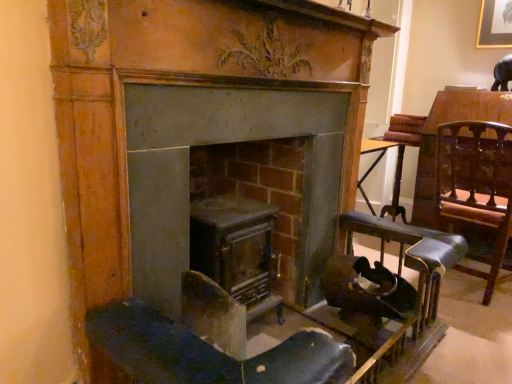
Identify the location of metallic gray stove at center, marked as the 2th fireplace in a right-to-left arrangement. The image size is (512, 384). pos(218,143).

The height and width of the screenshot is (384, 512). In order to click on metallic gray stove at center, marked as the 2th fireplace in a right-to-left arrangement in this screenshot , I will do `click(218, 143)`.

Does matte gray fireplace at center, which is the 2th fireplace in left-to-right order, touch leather seat at right?

matte gray fireplace at center, which is the 2th fireplace in left-to-right order, and leather seat at right are not in contact.

Who is shorter, matte gray fireplace at center, the 1th fireplace when ordered from right to left, or leather seat at right?

leather seat at right is shorter.

Which is farther, (79, 241) or (439, 204)?

The point (439, 204) is farther from the camera.

In terms of width, does matte gray fireplace at center, which is the 2th fireplace in left-to-right order, look wider or thinner when compared to leather seat at right?

matte gray fireplace at center, which is the 2th fireplace in left-to-right order, is thinner than leather seat at right.

Does point (441, 162) appear closer or farther from the camera than point (132, 116)?

Point (441, 162) is positioned farther from the camera compared to point (132, 116).

Considering the sizes of objects leather seat at right and metallic gray stove at center, which ranks as the first fireplace in left-to-right order, in the image provided, who is wider, leather seat at right or metallic gray stove at center, which ranks as the first fireplace in left-to-right order,?

metallic gray stove at center, which ranks as the first fireplace in left-to-right order.

From the image's perspective, which one is positioned higher, leather seat at right or metallic gray stove at center, marked as the 2th fireplace in a right-to-left arrangement?

From the image's view, leather seat at right is above.

Is the position of leather seat at right more distant than that of metallic gray stove at center, which ranks as the first fireplace in left-to-right order?

Yes, leather seat at right is further from the viewer.

In terms of height, does matte gray fireplace at center, the 1th fireplace when ordered from right to left, look taller or shorter compared to metallic gray stove at center, which ranks as the first fireplace in left-to-right order?

matte gray fireplace at center, the 1th fireplace when ordered from right to left, is taller than metallic gray stove at center, which ranks as the first fireplace in left-to-right order.

Considering the positions of objects matte gray fireplace at center, the 1th fireplace when ordered from right to left, and metallic gray stove at center, which ranks as the first fireplace in left-to-right order, in the image provided, who is more to the right, matte gray fireplace at center, the 1th fireplace when ordered from right to left, or metallic gray stove at center, which ranks as the first fireplace in left-to-right order,?

Positioned to the right is matte gray fireplace at center, the 1th fireplace when ordered from right to left.

Is matte gray fireplace at center, the 1th fireplace when ordered from right to left, not close to metallic gray stove at center, marked as the 2th fireplace in a right-to-left arrangement?

No, matte gray fireplace at center, the 1th fireplace when ordered from right to left, is not far away from metallic gray stove at center, marked as the 2th fireplace in a right-to-left arrangement.

Is leather seat at right taller or shorter than matte gray fireplace at center, which is the 2th fireplace in left-to-right order?

leather seat at right is shorter than matte gray fireplace at center, which is the 2th fireplace in left-to-right order.

Between point (477, 137) and point (113, 33), which one is positioned in front?

Positioned in front is point (113, 33).

Identify the location of swivel chair below the matte gray fireplace at center, the 1th fireplace when ordered from right to left (from a real-world perspective). (476, 186).

From the picture: Does leather seat at right touch matte gray fireplace at center, which is the 2th fireplace in left-to-right order?

No, leather seat at right is not in contact with matte gray fireplace at center, which is the 2th fireplace in left-to-right order.

From the image's perspective, is metallic gray stove at center, marked as the 2th fireplace in a right-to-left arrangement, above or below matte gray fireplace at center, the 1th fireplace when ordered from right to left?

Based on their image positions, metallic gray stove at center, marked as the 2th fireplace in a right-to-left arrangement, is located beneath matte gray fireplace at center, the 1th fireplace when ordered from right to left.

How much distance is there between metallic gray stove at center, marked as the 2th fireplace in a right-to-left arrangement, and matte gray fireplace at center, which is the 2th fireplace in left-to-right order?

metallic gray stove at center, marked as the 2th fireplace in a right-to-left arrangement, and matte gray fireplace at center, which is the 2th fireplace in left-to-right order, are 5.98 inches apart from each other.

How many degrees apart are the facing directions of metallic gray stove at center, marked as the 2th fireplace in a right-to-left arrangement, and matte gray fireplace at center, the 1th fireplace when ordered from right to left?

metallic gray stove at center, marked as the 2th fireplace in a right-to-left arrangement, and matte gray fireplace at center, the 1th fireplace when ordered from right to left, are facing 0.00153 degrees away from each other.

Is metallic gray stove at center, marked as the 2th fireplace in a right-to-left arrangement, oriented towards matte gray fireplace at center, which is the 2th fireplace in left-to-right order?

Yes, metallic gray stove at center, marked as the 2th fireplace in a right-to-left arrangement, is facing matte gray fireplace at center, which is the 2th fireplace in left-to-right order.

Can you confirm if metallic gray stove at center, marked as the 2th fireplace in a right-to-left arrangement, is shorter than leather seat at right?

Indeed, metallic gray stove at center, marked as the 2th fireplace in a right-to-left arrangement, has a lesser height compared to leather seat at right.

From a real-world perspective, is metallic gray stove at center, which ranks as the first fireplace in left-to-right order, on leather seat at right?

No.

Is metallic gray stove at center, which ranks as the first fireplace in left-to-right order, to the left or to the right of leather seat at right in the image?

In the image, metallic gray stove at center, which ranks as the first fireplace in left-to-right order, appears on the left side of leather seat at right.

Are metallic gray stove at center, which ranks as the first fireplace in left-to-right order, and leather seat at right beside each other?

No, metallic gray stove at center, which ranks as the first fireplace in left-to-right order, is not touching leather seat at right.

Where is `swivel chair below the matte gray fireplace at center, which is the 2th fireplace in left-to-right order (from a real-world perspective)`? swivel chair below the matte gray fireplace at center, which is the 2th fireplace in left-to-right order (from a real-world perspective) is located at coordinates (476, 186).

Find the location of a particular element. Image resolution: width=512 pixels, height=384 pixels. swivel chair located above the metallic gray stove at center, which ranks as the first fireplace in left-to-right order (from a real-world perspective) is located at coordinates (476, 186).

Consider the image. Based on their spatial positions, is matte gray fireplace at center, which is the 2th fireplace in left-to-right order, or leather seat at right further from metallic gray stove at center, marked as the 2th fireplace in a right-to-left arrangement?

leather seat at right lies further to metallic gray stove at center, marked as the 2th fireplace in a right-to-left arrangement, than the other object.

In the scene shown: From the image, which object appears to be farther from leather seat at right, metallic gray stove at center, which ranks as the first fireplace in left-to-right order, or matte gray fireplace at center, which is the 2th fireplace in left-to-right order?

metallic gray stove at center, which ranks as the first fireplace in left-to-right order, lies further to leather seat at right than the other object.

Based on their spatial positions, is leather seat at right or matte gray fireplace at center, which is the 2th fireplace in left-to-right order, closer to metallic gray stove at center, which ranks as the first fireplace in left-to-right order?

Based on the image, matte gray fireplace at center, which is the 2th fireplace in left-to-right order, appears to be nearer to metallic gray stove at center, which ranks as the first fireplace in left-to-right order.

Which object lies further to the anchor point matte gray fireplace at center, which is the 2th fireplace in left-to-right order, metallic gray stove at center, marked as the 2th fireplace in a right-to-left arrangement, or leather seat at right?

leather seat at right lies further to matte gray fireplace at center, which is the 2th fireplace in left-to-right order, than the other object.

Based on their spatial positions, is matte gray fireplace at center, which is the 2th fireplace in left-to-right order, or metallic gray stove at center, which ranks as the first fireplace in left-to-right order, further from leather seat at right?

The object further to leather seat at right is metallic gray stove at center, which ranks as the first fireplace in left-to-right order.

Based on their spatial positions, is leather seat at right or metallic gray stove at center, marked as the 2th fireplace in a right-to-left arrangement, further from matte gray fireplace at center, the 1th fireplace when ordered from right to left?

The object further to matte gray fireplace at center, the 1th fireplace when ordered from right to left, is leather seat at right.

This screenshot has width=512, height=384. In order to click on fireplace between metallic gray stove at center, marked as the 2th fireplace in a right-to-left arrangement, and leather seat at right, in the horizontal direction in this screenshot , I will do (x=177, y=83).